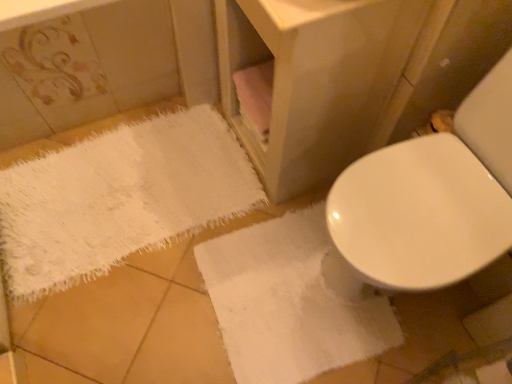
The width and height of the screenshot is (512, 384). I want to click on free region under white fluffy bath towel at lower left, the first bath towel positioned from the left (from a real-world perspective), so click(124, 194).